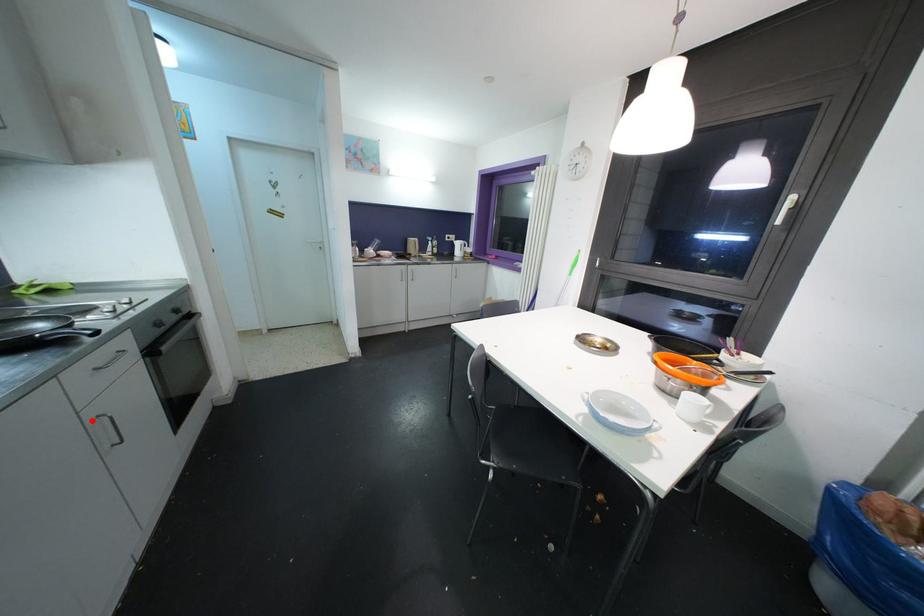
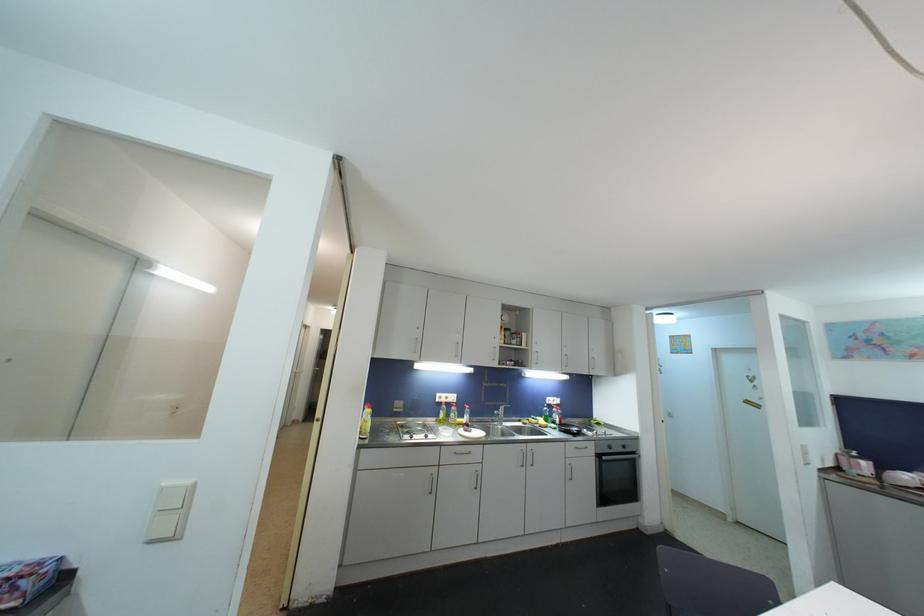
Where in the second image is the point corresponding to the highlighted location from the first image?

(570, 464)